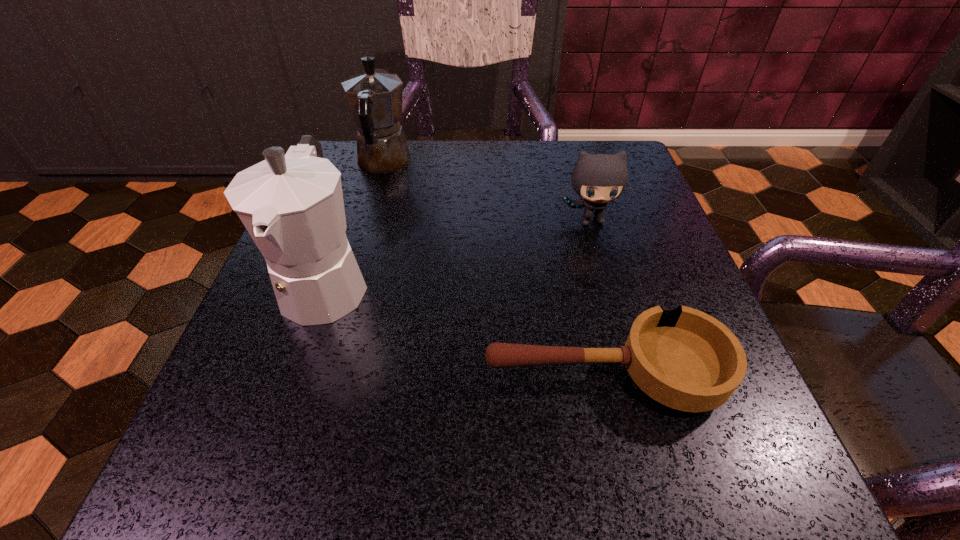
Locate which object is the third closest to the shortest object. Please provide its 2D coordinates. Your answer should be formatted as a tuple, i.e. [(x, y)], where the tuple contains the x and y coordinates of a point satisfying the conditions above.

[(375, 97)]

Find the location of a particular element. The width and height of the screenshot is (960, 540). vacant area that satisfies the following two spatial constraints: 1. at the spout of the nearer coffeepot; 2. with the handle on the side of the saucepan is located at coordinates [295, 375].

Where is `blank area in the image that satisfies the following two spatial constraints: 1. at the spout of the nearer coffeepot; 2. with the handle on the side of the shortest object`? The image size is (960, 540). blank area in the image that satisfies the following two spatial constraints: 1. at the spout of the nearer coffeepot; 2. with the handle on the side of the shortest object is located at coordinates (295, 375).

Find the location of a particular element. free space that satisfies the following two spatial constraints: 1. with the handle on the side of the shortest object; 2. at the spout of the nearer coffeepot is located at coordinates (583, 282).

The height and width of the screenshot is (540, 960). In order to click on free space that satisfies the following two spatial constraints: 1. with the handle on the side of the shortest object; 2. at the spout of the nearer coffeepot in this screenshot , I will do `click(583, 282)`.